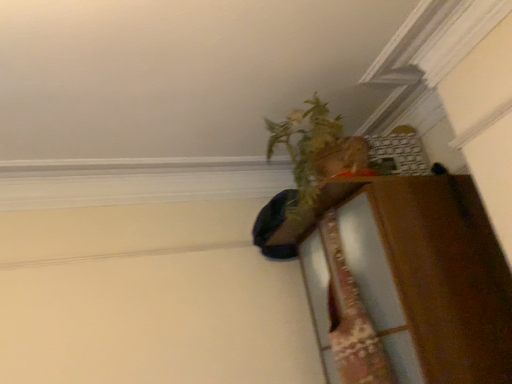
At what (x,y) coordinates should I click in order to perform the action: click on wooden dresser at right. Please return your answer as a coordinate pair (x, y). Image resolution: width=512 pixels, height=384 pixels. Looking at the image, I should click on (408, 282).

This screenshot has width=512, height=384. What do you see at coordinates (408, 282) in the screenshot?
I see `wooden dresser at right` at bounding box center [408, 282].

Identify the location of green leafy plant at upper right. (315, 164).

This screenshot has height=384, width=512. Describe the element at coordinates (315, 164) in the screenshot. I see `green leafy plant at upper right` at that location.

At what (x,y) coordinates should I click in order to perform the action: click on wooden dresser at right. Please return your answer as a coordinate pair (x, y). The image size is (512, 384). Looking at the image, I should click on (408, 282).

In the scene shown: Which is more to the left, green leafy plant at upper right or wooden dresser at right?

green leafy plant at upper right.

In the scene shown: Which object is further away from the camera, green leafy plant at upper right or wooden dresser at right?

green leafy plant at upper right is more distant.

Is point (298, 133) closer or farther from the camera than point (458, 249)?

Point (298, 133) is positioned farther from the camera compared to point (458, 249).

From the image's perspective, is green leafy plant at upper right above wooden dresser at right?

Yes, from the image's perspective, green leafy plant at upper right is above wooden dresser at right.

From a real-world perspective, does green leafy plant at upper right sit lower than wooden dresser at right?

No.

Considering the relative sizes of green leafy plant at upper right and wooden dresser at right in the image provided, is green leafy plant at upper right thinner than wooden dresser at right?

Correct, the width of green leafy plant at upper right is less than that of wooden dresser at right.

Does green leafy plant at upper right have a lesser height compared to wooden dresser at right?

Indeed, green leafy plant at upper right has a lesser height compared to wooden dresser at right.

Between green leafy plant at upper right and wooden dresser at right, which one has larger size?

Bigger between the two is wooden dresser at right.

Would you say green leafy plant at upper right is outside wooden dresser at right?

Yes, green leafy plant at upper right is not within wooden dresser at right.

Is green leafy plant at upper right far from wooden dresser at right?

That's not correct — green leafy plant at upper right is a little close to wooden dresser at right.

Is wooden dresser at right at the back of green leafy plant at upper right?

No, green leafy plant at upper right is not facing the opposite direction of wooden dresser at right.

Looking at this image, what's the angular difference between green leafy plant at upper right and wooden dresser at right's facing directions?

The angular difference between green leafy plant at upper right and wooden dresser at right is 88.6 degrees.

Locate an element on the screen. The width and height of the screenshot is (512, 384). dresser beneath the green leafy plant at upper right (from a real-world perspective) is located at coordinates tap(408, 282).

Which object is positioned more to the right, wooden dresser at right or green leafy plant at upper right?

wooden dresser at right.

Relative to green leafy plant at upper right, is wooden dresser at right in front or behind?

Clearly, wooden dresser at right is in front of green leafy plant at upper right.

Which point is more forward, (481,204) or (349,189)?

The point (349,189) is in front.

From the image's perspective, is wooden dresser at right above or below green leafy plant at upper right?

wooden dresser at right is situated lower than green leafy plant at upper right in the image.

From a real-world perspective, is wooden dresser at right beneath green leafy plant at upper right?

Yes, from a real-world perspective, wooden dresser at right is beneath green leafy plant at upper right.

Which of these two, wooden dresser at right or green leafy plant at upper right, is thinner?

With smaller width is green leafy plant at upper right.

Which of these two, wooden dresser at right or green leafy plant at upper right, stands shorter?

green leafy plant at upper right.

Who is bigger, wooden dresser at right or green leafy plant at upper right?

wooden dresser at right is bigger.

Is wooden dresser at right completely or partially outside of green leafy plant at upper right?

Absolutely, wooden dresser at right is external to green leafy plant at upper right.

Is wooden dresser at right far from green leafy plant at upper right?

wooden dresser at right is near green leafy plant at upper right, not far away.

Is wooden dresser at right oriented away from green leafy plant at upper right?

No, green leafy plant at upper right is not at the back of wooden dresser at right.

How different are the orientations of wooden dresser at right and green leafy plant at upper right in degrees?

The angle between the facing direction of wooden dresser at right and the facing direction of green leafy plant at upper right is 88.6 degrees.

Where is `houseplant that appears behind the wooden dresser at right`? The height and width of the screenshot is (384, 512). houseplant that appears behind the wooden dresser at right is located at coordinates (315, 164).

This screenshot has height=384, width=512. In order to click on houseplant above the wooden dresser at right (from the image's perspective) in this screenshot , I will do `click(315, 164)`.

The height and width of the screenshot is (384, 512). I want to click on houseplant above the wooden dresser at right (from a real-world perspective), so click(x=315, y=164).